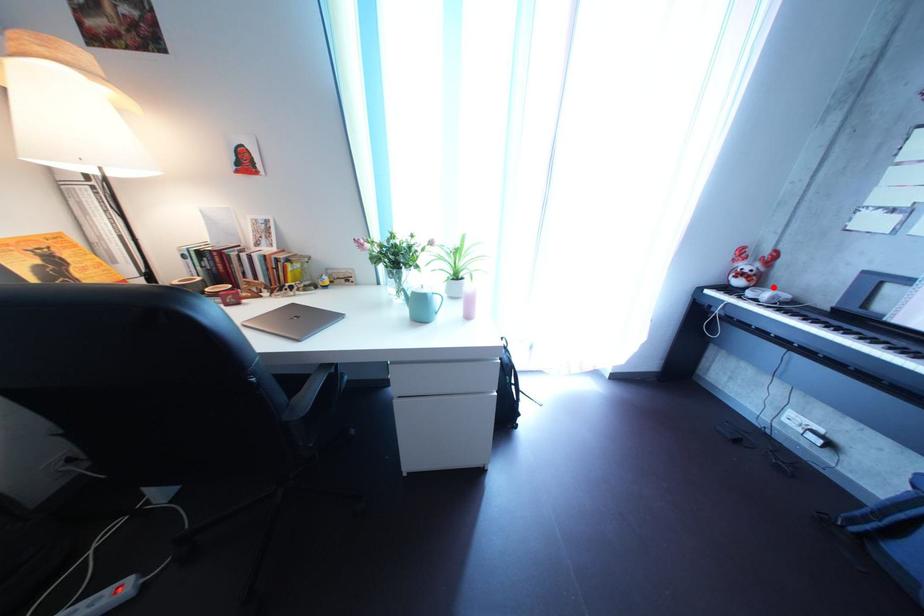
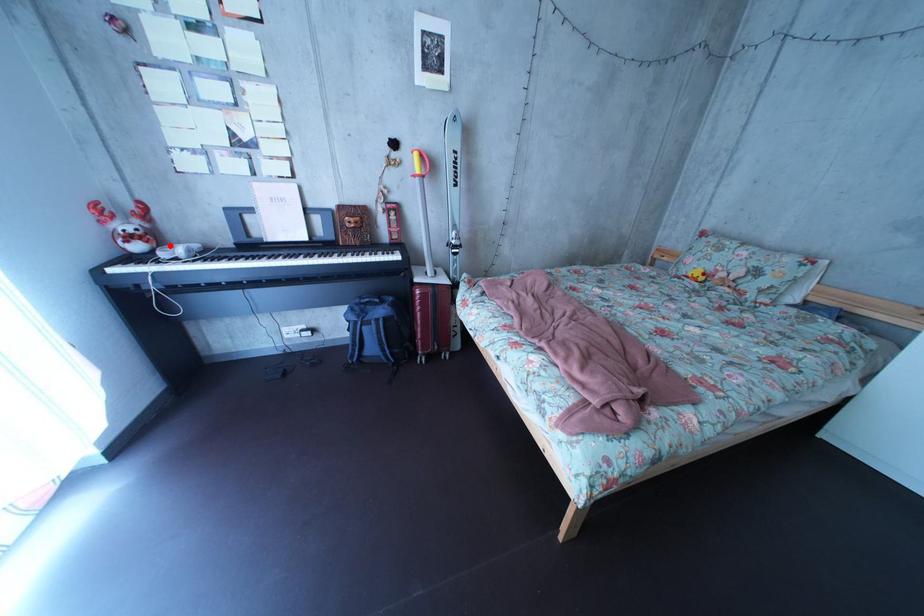
I am providing you with two images of the same scene from different viewpoints. A red point is marked on the first image and another point is marked on the second image. Is the marked point in image1 the same physical position as the marked point in image2?

Yes